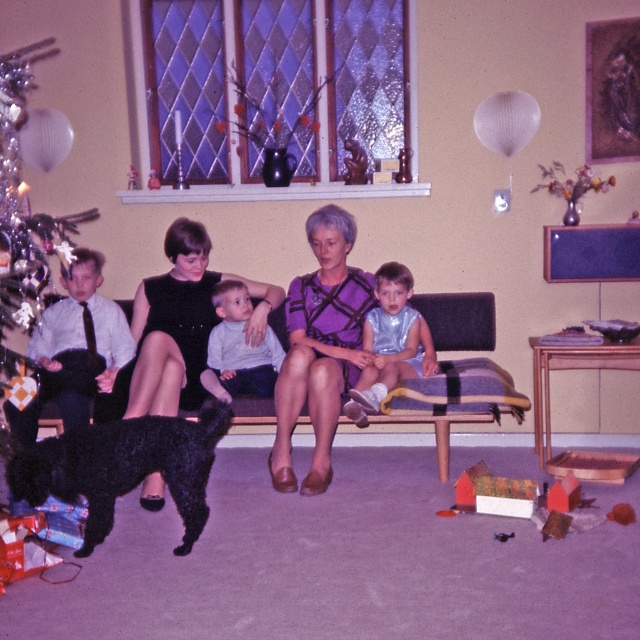
Question: Is shiny black dog at lower left further to the viewer compared to purple fabric dress at center?

Choices:
 (A) no
 (B) yes

Answer: (B)

Question: Does shiny black dog at lower left appear over shiny silver outfit at center?

Choices:
 (A) yes
 (B) no

Answer: (A)

Question: Is purple fabric dress at center smaller than light gray cotton shirt at center?

Choices:
 (A) no
 (B) yes

Answer: (A)

Question: Which of the following is the closest to the observer?

Choices:
 (A) (131, 390)
 (B) (13, 225)

Answer: (B)

Question: Which point appears farthest from the camera in this image?

Choices:
 (A) (412, 358)
 (B) (314, 369)
 (C) (97, 448)
 (D) (36, 221)

Answer: (A)

Question: Which of the following is the closest to the observer?

Choices:
 (A) (186, 432)
 (B) (0, 333)

Answer: (A)